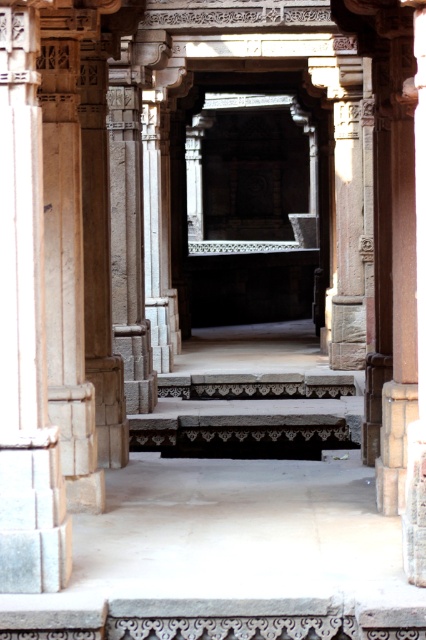
You are an archaeologist exploring the ancient structure. You need to reach the higher platform by the dark gray stone stairs at center but must first pass the gray stone pillar at left. Which object will you encounter first as you move towards the stairs?

You will first encounter the gray stone pillar at left because it is closer to the viewer than the dark gray stone stairs at center, so you will reach it before the stairs.